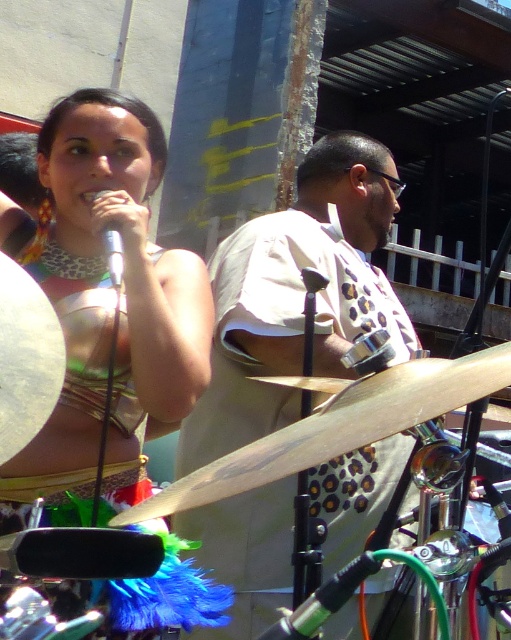
You are a stagehand setting up for a concert. You need to place a new amplifier that is 1.2 meters tall. The wooden drum at center and the silver metallic microphone at upper center are already in place. Can the amplifier fit between them vertically?

The wooden drum at center is taller than the silver metallic microphone at upper center. Since the amplifier is 1.2 meters tall, it depends on the height of the drum and microphone. However, since the drum is taller than the microphone, if the microphone is at least 1.2 meters tall, the amplifier can fit. But if the drum is taller than 1.2 meters, it might not. The exact height isn

You are a photographer at the musical performance. You want to capture a closeup of the singer without any distracting elements in the frame. The singer is at the center of the image. There is a matte gold necklace at upper left located at point (124, 266). Will the necklace be visible in your closeup of the singer?

The matte gold necklace at upper left is located at point (124, 266). Since the singer is at the center of the image, the necklace at upper left may still be within the frame depending on the zoom level. However, without knowing the exact zoom or field of view, it is impossible to determine visibility definitively.

Looking at this image, you are a photographer setting up for the outdoor musical performance. You notice the matte gold necklace at upper left and the wooden drum at center. Which object is positioned higher in the image?

The matte gold necklace at upper left is taller than the wooden drum at center, so it is positioned higher in the image.